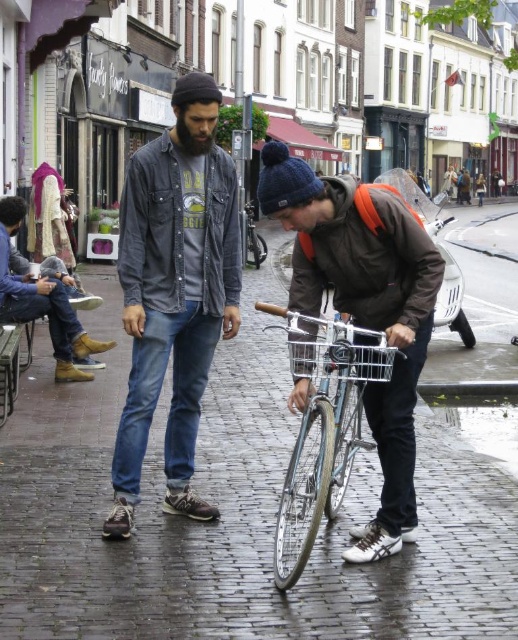
Can you confirm if metallic silver basket at center is wider than shiny silver bicycle at center?

Indeed, metallic silver basket at center has a greater width compared to shiny silver bicycle at center.

Can you confirm if metallic silver basket at center is shorter than shiny silver bicycle at center?

Yes.

Is point (362, 374) positioned before point (248, 202)?

Yes.

Where is `metallic silver basket at center`? metallic silver basket at center is located at coordinates (342, 356).

Does wet cobblestone pavement at center have a larger size compared to leather boots at lower left?

Indeed, wet cobblestone pavement at center has a larger size compared to leather boots at lower left.

Is wet cobblestone pavement at center below leather boots at lower left?

Yes, wet cobblestone pavement at center is below leather boots at lower left.

Is point (384, 620) positioned before point (8, 273)?

Yes, point (384, 620) is in front of point (8, 273).

Find the location of a particular element. wet cobblestone pavement at center is located at coordinates (234, 515).

Does matte brown jacket at center have a larger size compared to shiny silver bicycle at center?

Correct, matte brown jacket at center is larger in size than shiny silver bicycle at center.

Does matte brown jacket at center appear on the left side of shiny silver bicycle at center?

Incorrect, matte brown jacket at center is not on the left side of shiny silver bicycle at center.

Who is more forward, (x=392, y=506) or (x=247, y=216)?

Point (x=392, y=506) is in front.

This screenshot has height=640, width=518. I want to click on matte brown jacket at center, so click(364, 308).